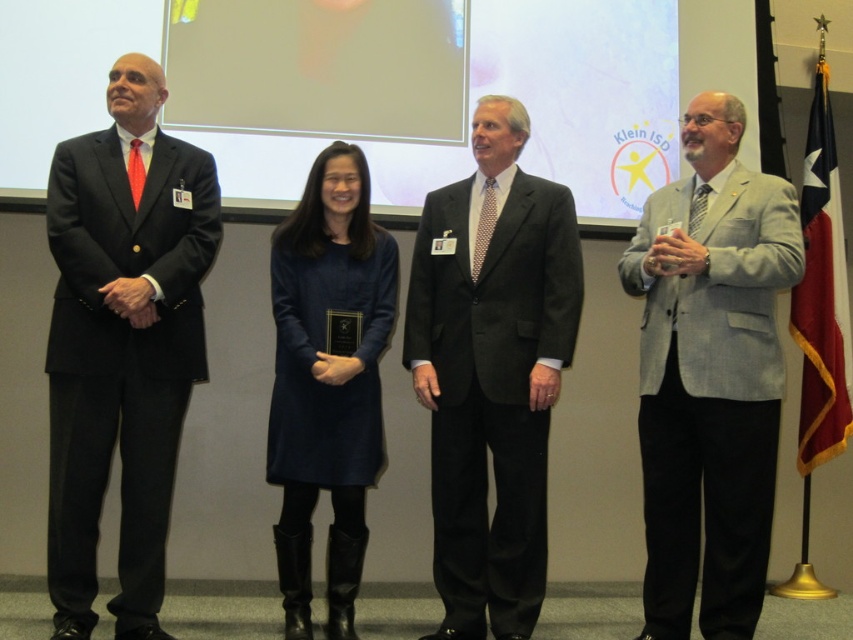
Locate an element on the screen. Image resolution: width=853 pixels, height=640 pixels. black suit at left is located at coordinates [122, 342].

What do you see at coordinates (122, 342) in the screenshot?
I see `black suit at left` at bounding box center [122, 342].

Locate an element on the screen. The height and width of the screenshot is (640, 853). black suit at left is located at coordinates (122, 342).

Which of these two, gray textured blazer at right or dark gray suit at center, stands taller?

With more height is dark gray suit at center.

Is gray textured blazer at right thinner than dark gray suit at center?

Yes, gray textured blazer at right is thinner than dark gray suit at center.

Does point (706, 604) come farther from viewer compared to point (482, 172)?

No, (706, 604) is closer to viewer.

Locate an element on the screen. The height and width of the screenshot is (640, 853). gray textured blazer at right is located at coordinates (711, 374).

Is black suit at left above dark blue fabric dress at center?

Indeed, black suit at left is positioned over dark blue fabric dress at center.

Who is shorter, black suit at left or dark blue fabric dress at center?

Standing shorter between the two is dark blue fabric dress at center.

This screenshot has width=853, height=640. In order to click on black suit at left in this screenshot , I will do `click(122, 342)`.